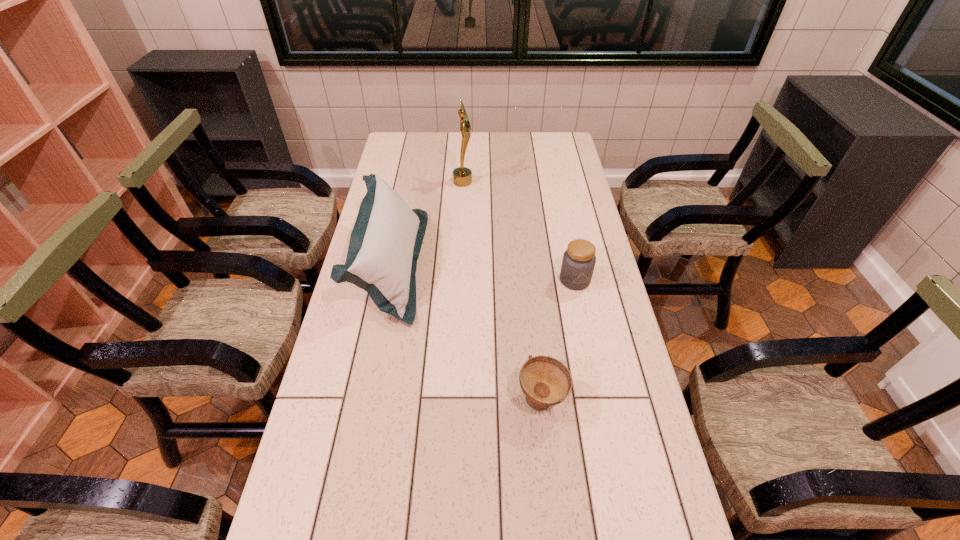
Image resolution: width=960 pixels, height=540 pixels. I want to click on the third object from right to left, so click(x=462, y=176).

Find the location of a particular element. the farthest object is located at coordinates (462, 176).

The height and width of the screenshot is (540, 960). In order to click on cushion in this screenshot , I will do `click(385, 243)`.

Find the location of a particular element. the leftmost object is located at coordinates (385, 243).

The image size is (960, 540). In order to click on the second shortest object in this screenshot , I will do `click(578, 263)`.

Identify the location of the rightmost object. (578, 263).

I want to click on the shortest object, so click(545, 381).

You are a GUI agent. You are given a task and a screenshot of the screen. Output one action in this format:
    pyautogui.click(x=<x>, y=<y>)
    Task: Click on the soup bowl
    This screenshot has height=540, width=960.
    Given the screenshot: What is the action you would take?
    pyautogui.click(x=545, y=381)

You are a GUI agent. You are given a task and a screenshot of the screen. Output one action in this format:
    pyautogui.click(x=<x>, y=<y>)
    Task: Click on the free space located 0.270m on the front-facing side of the second object from left to right
    This screenshot has height=540, width=960.
    Given the screenshot: What is the action you would take?
    pyautogui.click(x=540, y=181)

What are the coordinates of `vacant space located 0.100m on the surface of the leftmost object` in the screenshot? It's located at (453, 265).